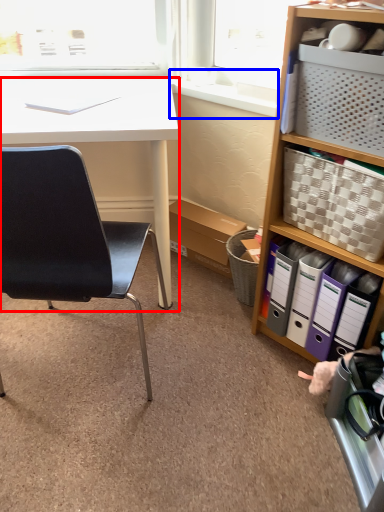
Question: Which of the following is the closest to the observer, desk (highlighted by a red box) or window sill (highlighted by a blue box)?

Choices:
 (A) desk
 (B) window sill

Answer: (A)